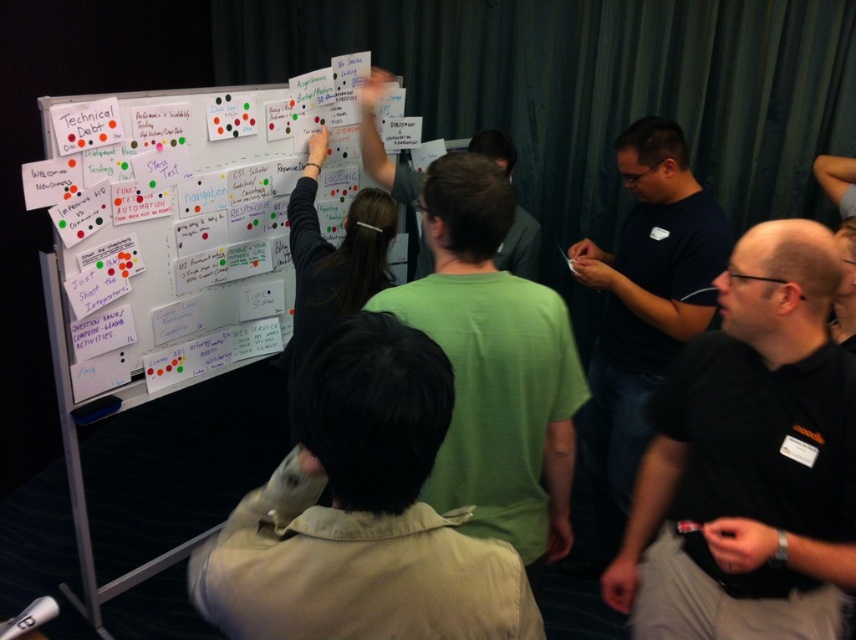
Can you confirm if black shirt at lower right is positioned to the left of green matte shirt at upper center?

No, black shirt at lower right is not to the left of green matte shirt at upper center.

Is black shirt at lower right taller than green matte shirt at upper center?

Correct, black shirt at lower right is much taller as green matte shirt at upper center.

Describe the element at coordinates (750, 460) in the screenshot. I see `black shirt at lower right` at that location.

At what (x,y) coordinates should I click in order to perform the action: click on black shirt at lower right. Please return your answer as a coordinate pair (x, y). Looking at the image, I should click on (750, 460).

Is point (128, 148) less distant than point (541, 410)?

No, it is not.

Does point (191, 220) come behind point (444, 186)?

Yes, it is behind point (444, 186).

Locate an element on the screen. white paperboard at upper left is located at coordinates (183, 237).

Is white paperboard at upper left wider than khaki cotton shirt at center?

Yes.

Is white paperboard at upper left shorter than khaki cotton shirt at center?

No, white paperboard at upper left is not shorter than khaki cotton shirt at center.

Measure the distance between point (116, 234) and camera.

The distance of point (116, 234) from camera is 7.18 feet.

The width and height of the screenshot is (856, 640). What are the coordinates of `white paperboard at upper left` in the screenshot? It's located at (183, 237).